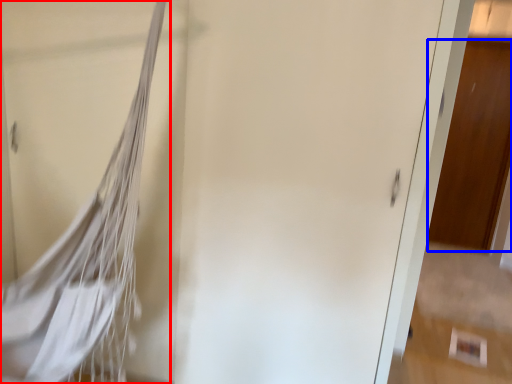
Question: Which of the following is the closest to the observer, tennis net (highlighted by a red box) or door (highlighted by a blue box)?

Choices:
 (A) tennis net
 (B) door

Answer: (A)